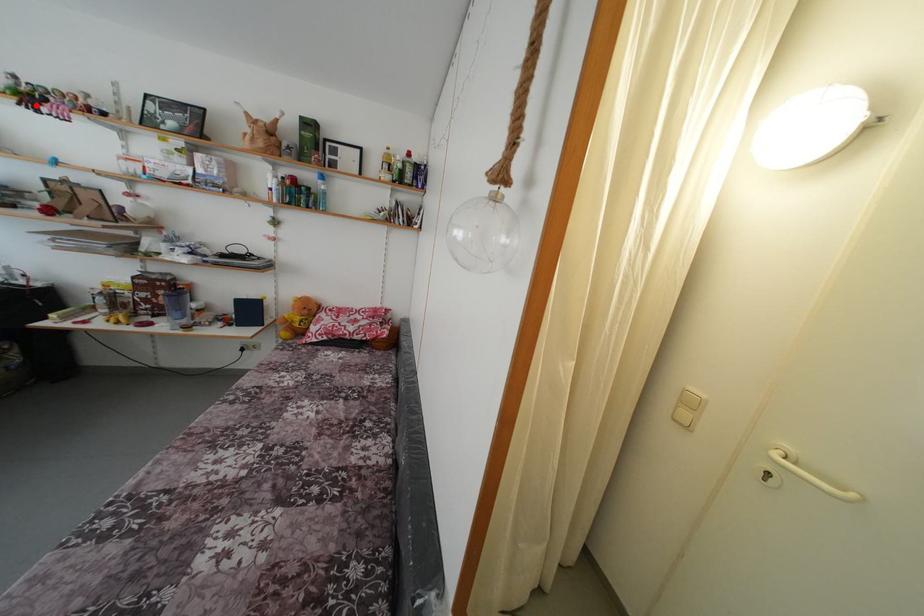
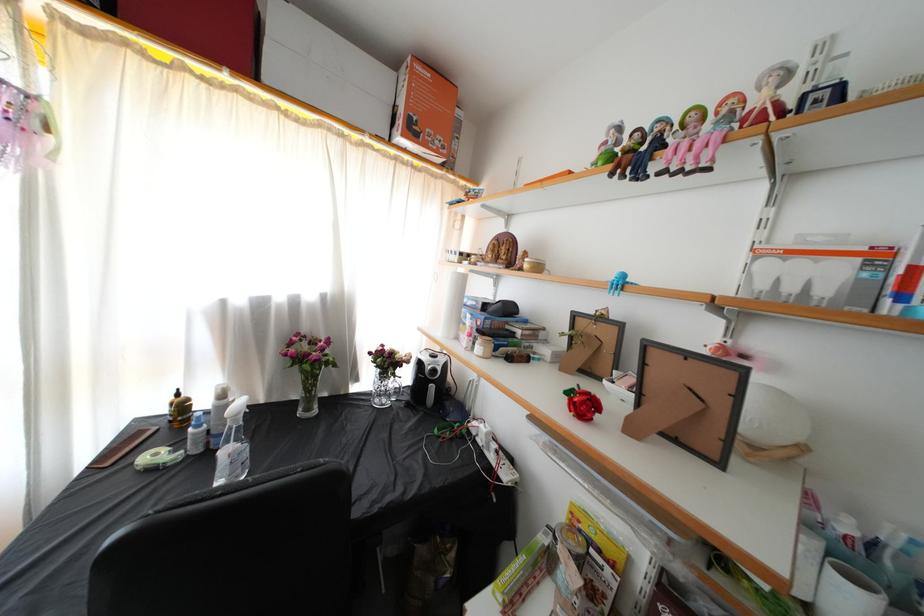
In the second image, find the point that corresponds to the highlighted location in the first image.

(638, 161)